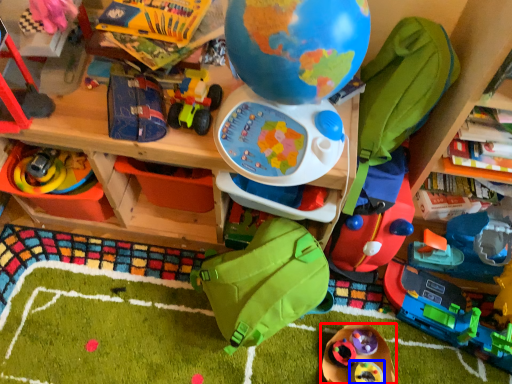
Question: Among these objects, which one is farthest to the camera, toy (highlighted by a red box) or toy (highlighted by a blue box)?

Choices:
 (A) toy
 (B) toy

Answer: (B)